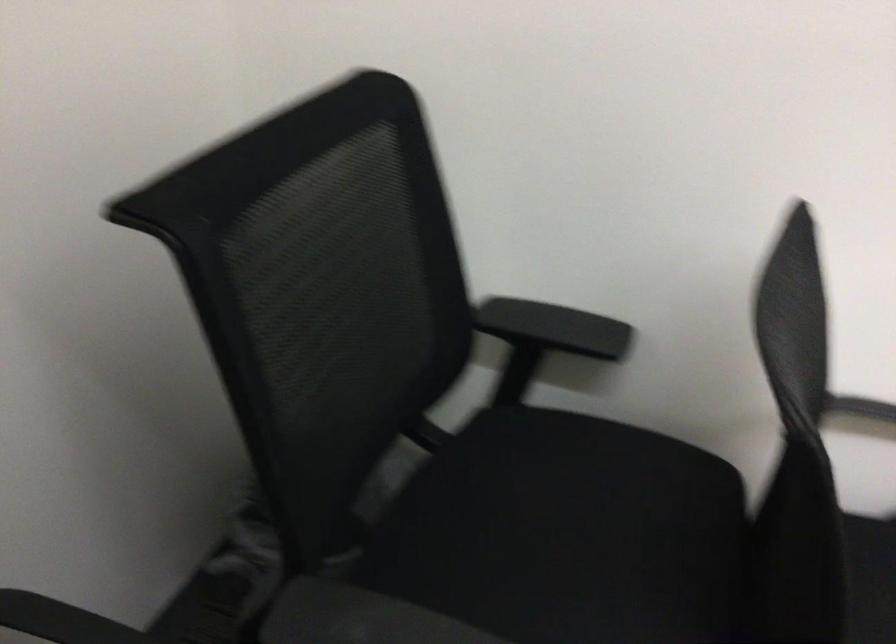
Find where to rest the black chair armrest. Please return your answer as a coordinate pair (x, y).

(554, 327)